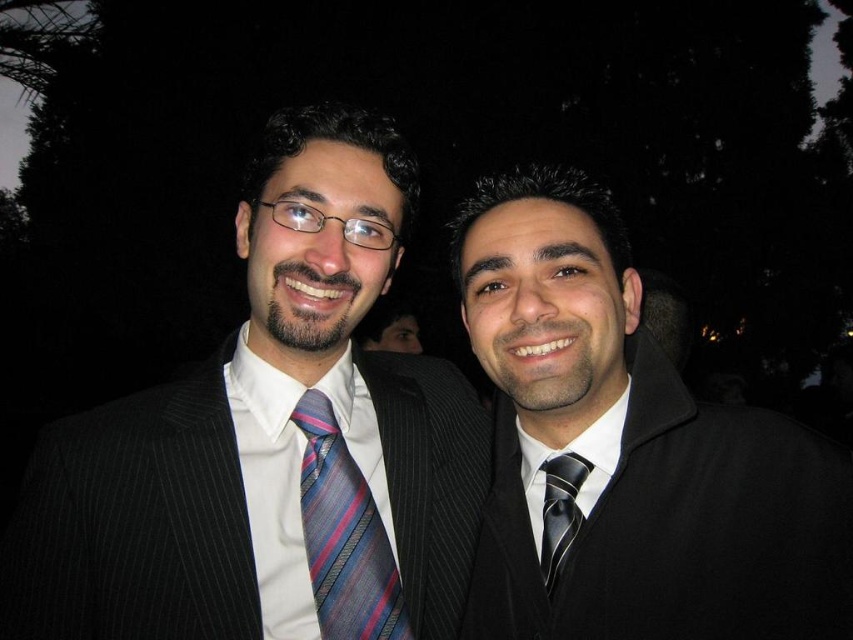
You are organizing a charity event and need to ensure that all donated items fit in a storage box. You have a matte black suit at left and a black silk tie at center. Given that the storage box can only accommodate items up to the size of the larger object between them, which item should you prioritize placing first?

The matte black suit at left is bigger than the black silk tie at center, so you should prioritize placing the matte black suit at left first to ensure it fits in the storage box.

You are a photographer adjusting the lighting for a portrait. You notice the striped silk tie at center and the black silk tie at center. Which tie is located to the left of the other?

The striped silk tie at center is positioned on the left side of black silk tie at center.

You are a photographer setting up for a portrait. You have a camera with a 50mm lens and want to ensure both the matte black suit at left and the black silk suit at center are in focus. The depth of field at this lens setting allows for sharp focus within a 15 inch range. Can both suits be captured clearly in the same shot?

The matte black suit at left and the black silk suit at center are 16.39 inches apart, which exceeds the 15 inch depth of field range. Therefore, both cannot be fully in focus simultaneously with the current lens setting.